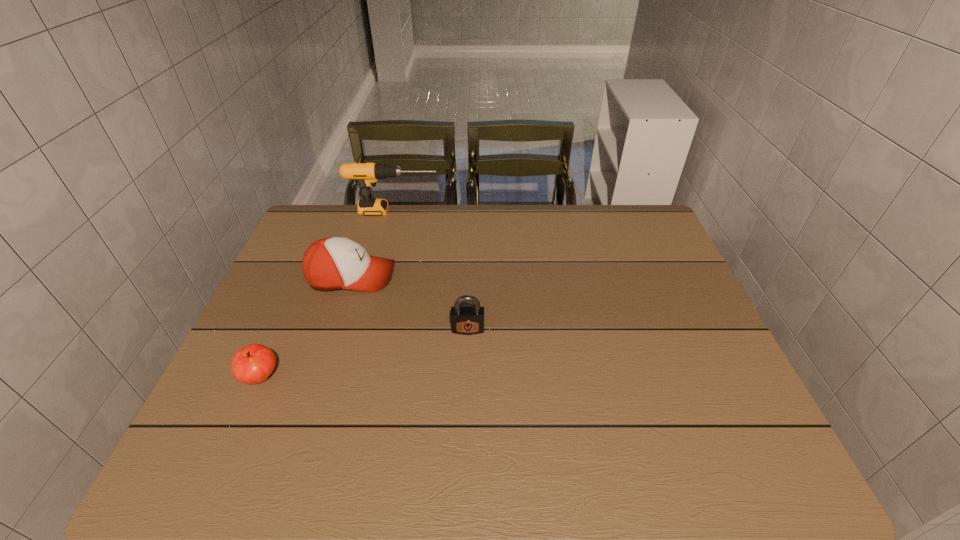
This screenshot has width=960, height=540. Find the location of `drill`. drill is located at coordinates (367, 174).

Locate an element on the screen. The image size is (960, 540). the tallest object is located at coordinates (367, 174).

The height and width of the screenshot is (540, 960). I want to click on the second farthest object, so (x=332, y=263).

Find the location of a particular element. The width and height of the screenshot is (960, 540). the second nearest object is located at coordinates (466, 320).

You are a GUI agent. You are given a task and a screenshot of the screen. Output one action in this format:
    pyautogui.click(x=<x>, y=<y>)
    Task: Click on the padlock
    The width and height of the screenshot is (960, 540).
    Given the screenshot: What is the action you would take?
    pyautogui.click(x=466, y=320)

Find the location of `the shortest object`. the shortest object is located at coordinates (252, 364).

At what (x,y) coordinates should I click in order to perform the action: click on apple. Please return your answer as a coordinate pair (x, y). Looking at the image, I should click on (252, 364).

Identify the location of vacant space located 0.300m on the handle side of the drill. (526, 212).

Locate an element on the screen. free space located on the front-facing side of the baseball cap is located at coordinates (507, 276).

In order to click on vacant space located 0.350m on the front of the second nearest object near the keyhole in this screenshot , I will do `click(464, 475)`.